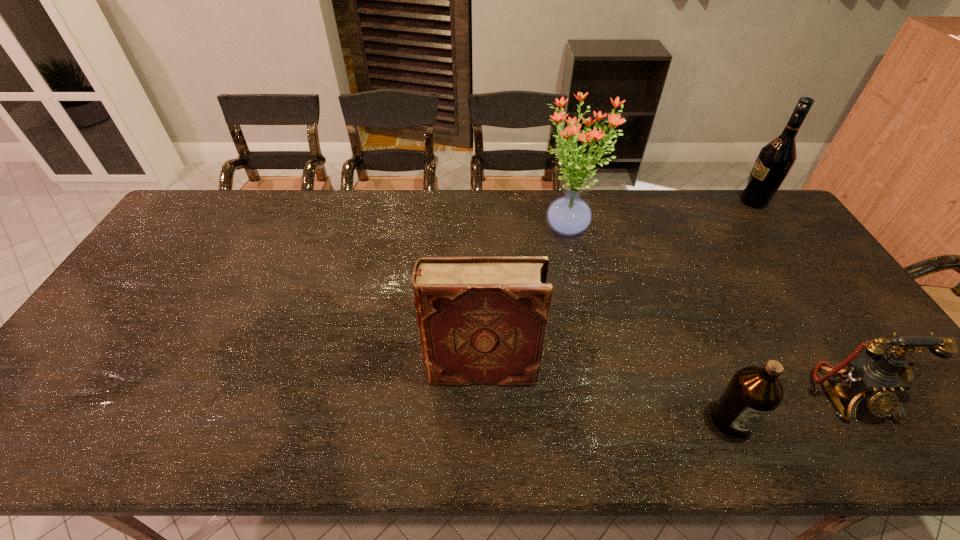
I want to click on object present at the near right corner, so click(877, 378).

Image resolution: width=960 pixels, height=540 pixels. In the image, there is a desktop. Find the location of `vacant space at the far edge`. vacant space at the far edge is located at coordinates (492, 204).

Locate an element on the screen. The height and width of the screenshot is (540, 960). free space at the near edge of the desktop is located at coordinates (338, 423).

Where is `free space at the left edge`? free space at the left edge is located at coordinates (194, 234).

Find the location of a particular element. The height and width of the screenshot is (540, 960). free space at the far right corner of the desktop is located at coordinates (735, 220).

Where is `free spot between the hardback book and the telephone`? free spot between the hardback book and the telephone is located at coordinates (665, 382).

Locate an element on the screen. The width and height of the screenshot is (960, 540). vacant area that lies between the wine bottle and the telephone is located at coordinates (802, 298).

Locate an element on the screen. This screenshot has height=540, width=960. vacant space that's between the wine bottle and the hardback book is located at coordinates (617, 286).

The image size is (960, 540). In order to click on free space between the leftmost object and the wine bottle in this screenshot , I will do `click(617, 286)`.

This screenshot has width=960, height=540. I want to click on free space between the third object from left to right and the leftmost object, so click(606, 395).